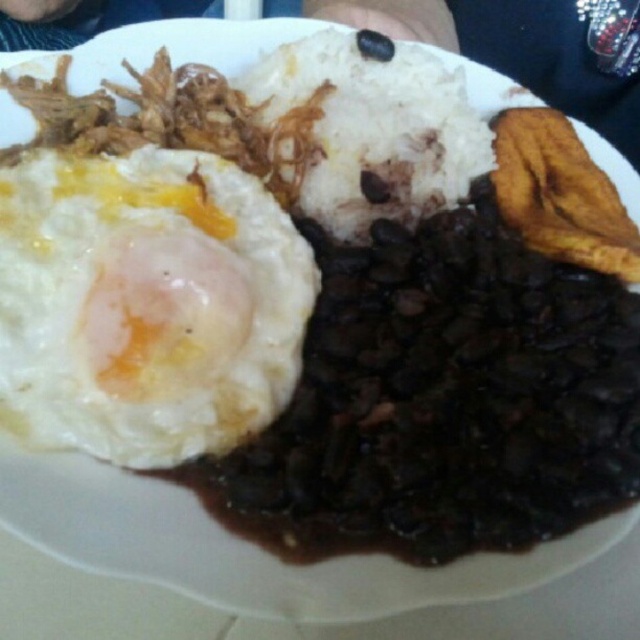
Question: Is white fluffy egg at upper left positioned in front of white matte rice at center?

Choices:
 (A) yes
 (B) no

Answer: (A)

Question: Considering the real-world distances, which object is farthest from the white matte rice at center?

Choices:
 (A) black matte bean at center
 (B) white fluffy egg at upper left

Answer: (B)

Question: Is white matte rice at center wider than black matte bean at center?

Choices:
 (A) yes
 (B) no

Answer: (A)

Question: Which point is farther to the camera?

Choices:
 (A) black matte bean at center
 (B) white fluffy egg at upper left

Answer: (A)

Question: Is white fluffy egg at upper left wider than black matte bean at center?

Choices:
 (A) no
 (B) yes

Answer: (B)

Question: Which of these objects is positioned farthest from the black matte bean at center?

Choices:
 (A) white fluffy egg at upper left
 (B) white matte rice at center

Answer: (A)